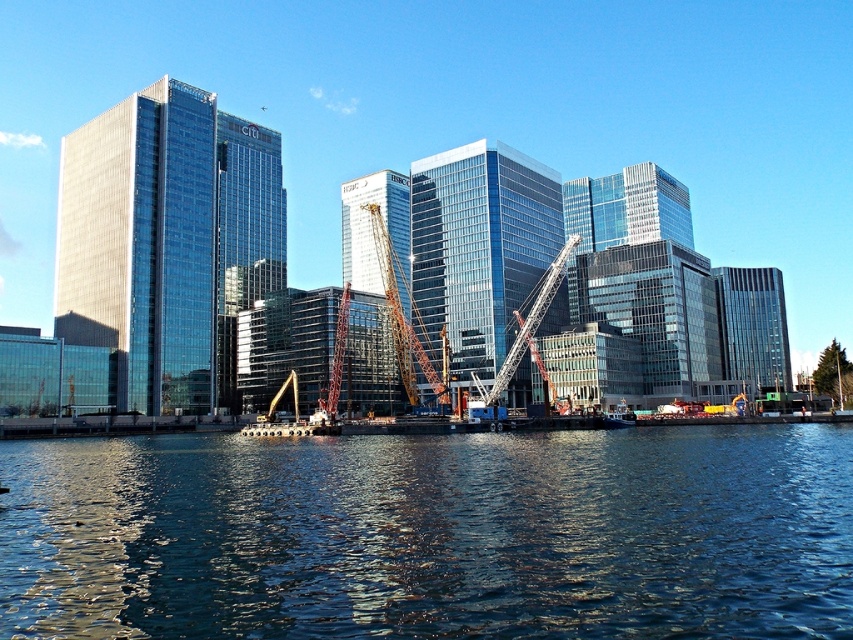
Question: Estimate the real-world distances between objects in this image. Which object is closer to the dark blue water at lower center?

Choices:
 (A) glassy steel tower at center
 (B) glassy reflective skyscraper at center
 (C) glassy reflective building at right
 (D) yellow metallic crane at center

Answer: (B)

Question: Is glassy steel tower at center positioned in front of yellow metallic crane at center?

Choices:
 (A) yes
 (B) no

Answer: (B)

Question: Based on their relative distances, which object is farther from the shiny glass skyscraper at left?

Choices:
 (A) dark blue water at lower center
 (B) glassy reflective building at right
 (C) orange metallic crane at center
 (D) glassy reflective skyscraper at center

Answer: (B)

Question: Does dark blue water at lower center have a smaller size compared to transparent glass skyscraper at center?

Choices:
 (A) yes
 (B) no

Answer: (B)

Question: Is transparent glass skyscraper at center above orange metallic crane at center?

Choices:
 (A) yes
 (B) no

Answer: (A)

Question: Which object is closer to the camera taking this photo?

Choices:
 (A) transparent glass skyscraper at center
 (B) glassy steel tower at center

Answer: (B)